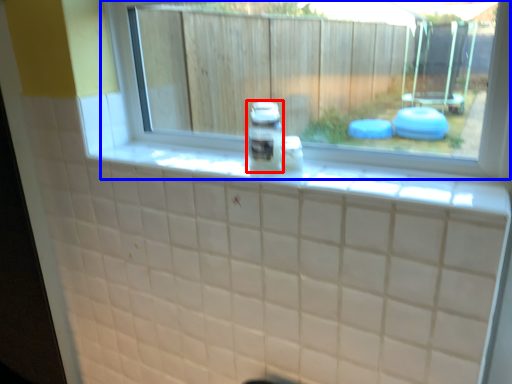
Question: Which object is closer to the camera taking this photo, glass jar (highlighted by a red box) or window (highlighted by a blue box)?

Choices:
 (A) glass jar
 (B) window

Answer: (B)